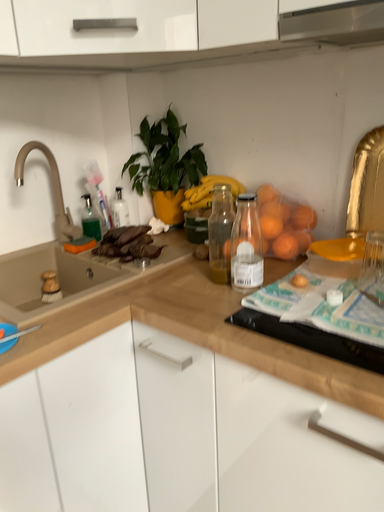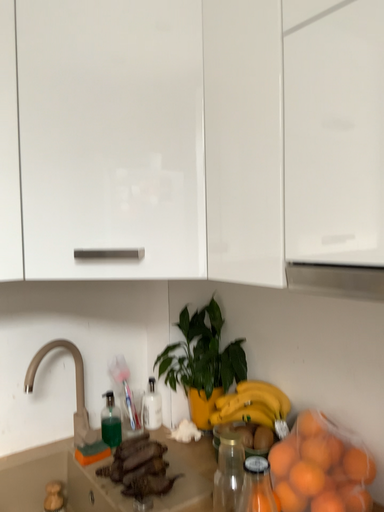
Question: How did the camera likely rotate when shooting the video?

Choices:
 (A) rotated right
 (B) rotated left

Answer: (B)